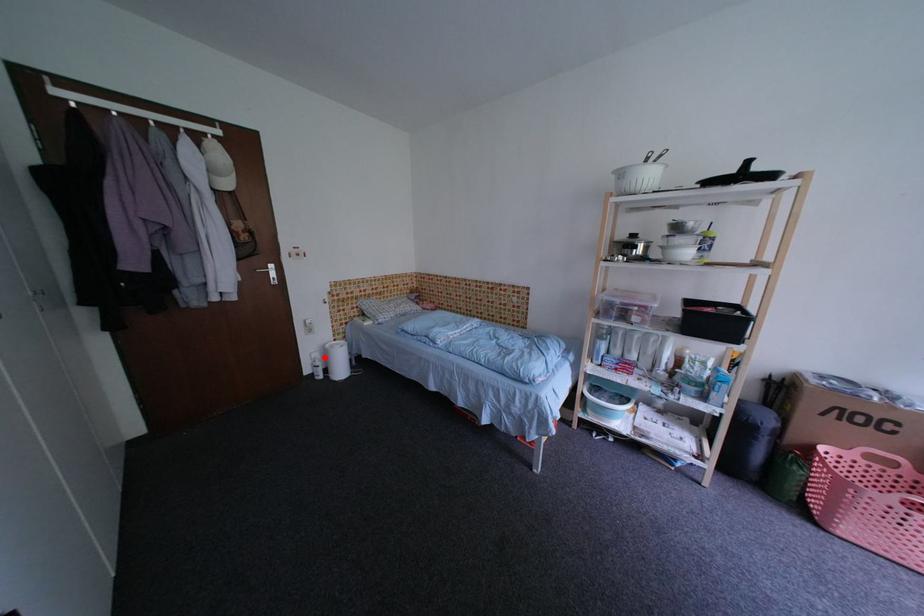
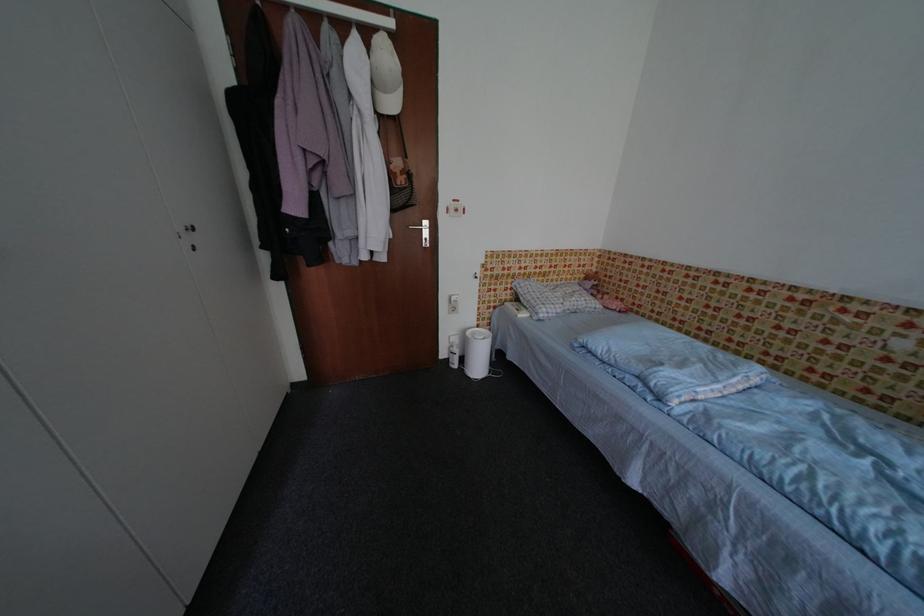
Question: I am providing you with two images of the same scene from different viewpoints. Given a red point in image1, look at the same physical point in image2. Is it:

Choices:
 (A) Closer to the viewpoint
 (B) Farther from the viewpoint

Answer: (B)